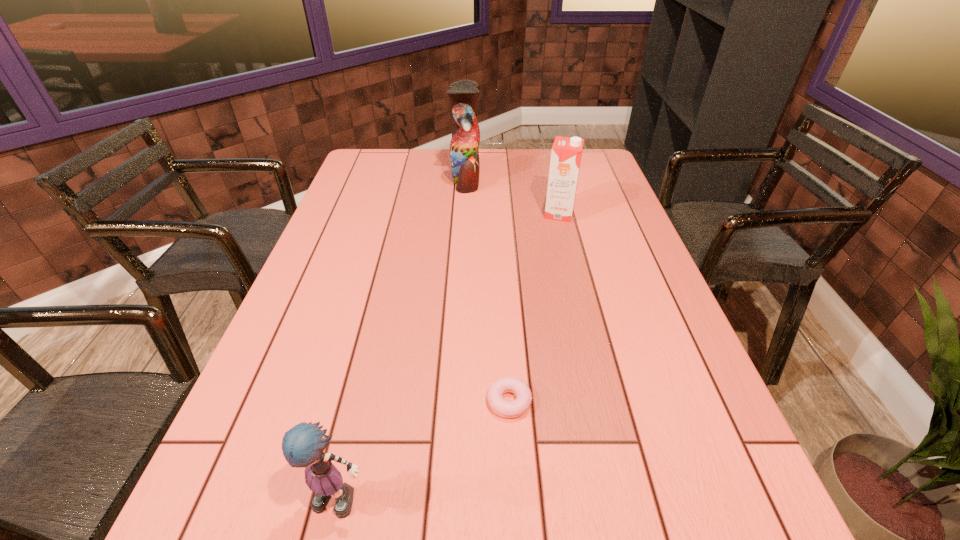
Find the location of a particular element. free space that is in between the nearest object and the carton is located at coordinates (451, 357).

Where is `free space that is in between the doughnut and the carton`? This screenshot has height=540, width=960. free space that is in between the doughnut and the carton is located at coordinates (x=534, y=307).

Where is `empty space between the second object from left to right and the rag doll`? empty space between the second object from left to right and the rag doll is located at coordinates (404, 339).

Image resolution: width=960 pixels, height=540 pixels. Find the location of `vacant point located between the shortest object and the rightmost object`. vacant point located between the shortest object and the rightmost object is located at coordinates (534, 307).

Locate an element on the screen. The width and height of the screenshot is (960, 540). free area in between the leftmost object and the tallest object is located at coordinates (404, 339).

Locate an element on the screen. The image size is (960, 540). free point between the third nearest object and the second object from right to left is located at coordinates (534, 307).

At what (x,y) coordinates should I click in order to perform the action: click on free spot between the doughnut and the third tallest object. Please return your answer as a coordinate pair (x, y). This screenshot has height=540, width=960. Looking at the image, I should click on (426, 450).

Where is `object that is the third closest to the doughnut`? The image size is (960, 540). object that is the third closest to the doughnut is located at coordinates (464, 154).

Identify the location of object that is the second closest to the rag doll. (566, 154).

I want to click on free point that satisfies the following two spatial constraints: 1. at the face of the second object from right to left; 2. on the left side of the second object from left to right, so click(454, 401).